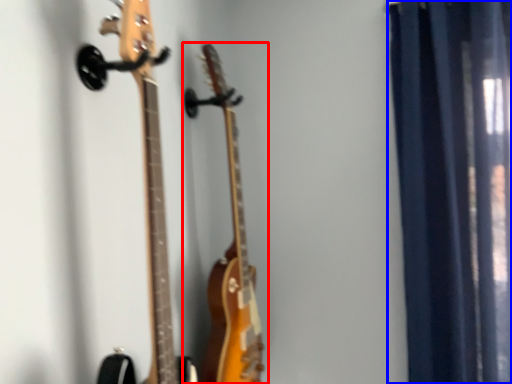
Question: Which object appears closest to the camera in this image, guitar (highlighted by a red box) or curtain (highlighted by a blue box)?

Choices:
 (A) guitar
 (B) curtain

Answer: (A)